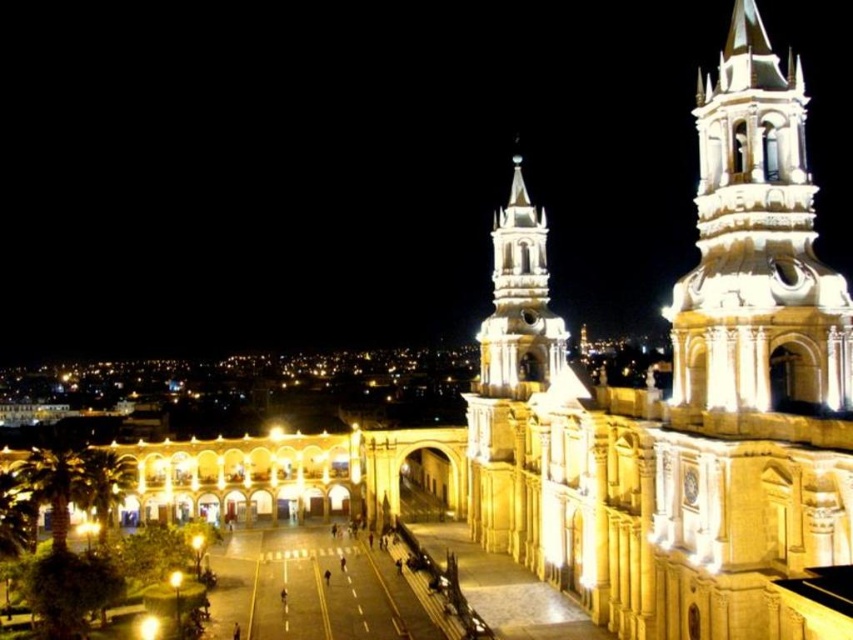
Consider the image. You are standing in the plaza in front of the building and want to take a photo that includes both the white stone tower at upper right and the white stone tower at center. Which tower should you position to your left to capture both in the frame?

You should position the white stone tower at center to your left because the white stone tower at upper right is on its right side, so arranging them with the center tower on the left and the upper right tower on the right will include both in the frame.

You are standing in the plaza in front of the cathedral. You want to take a photo of the white stone tower at upper right. Where should you position yourself to capture the tower in the frame?

To capture the white stone tower at upper right in your photo, position yourself near the plaza in front of the cathedral, as the tower is located at point 0.388 on the x axis and 0.889 on the y axis.